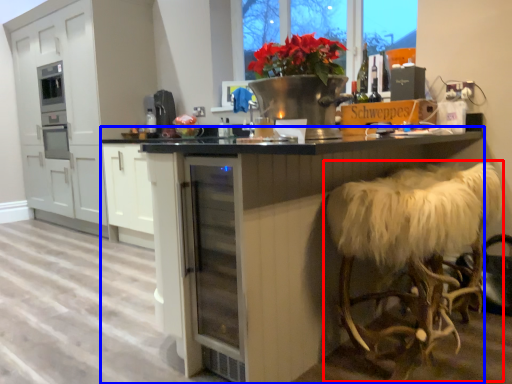
Question: Which object is further to the camera taking this photo, swivel chair (highlighted by a red box) or table (highlighted by a blue box)?

Choices:
 (A) swivel chair
 (B) table

Answer: (A)